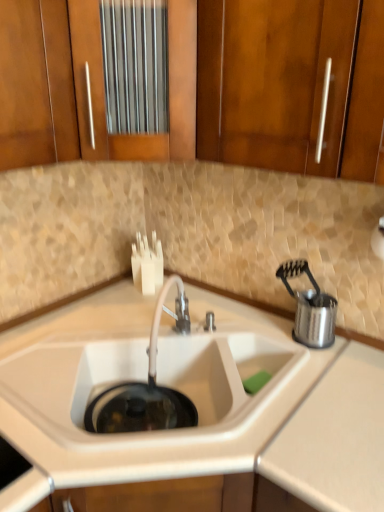
Find the location of a particular element. The width and height of the screenshot is (384, 512). vacant space in front of stainless steel utensil holder at right is located at coordinates (304, 362).